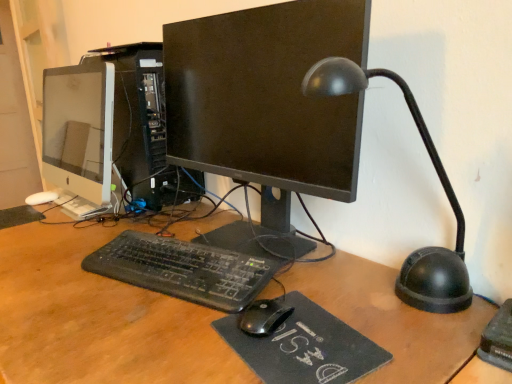
Question: Considering their positions, is white glossy monitor at left, the first computer monitor in the left-to-right sequence, located in front of or behind black plastic table lamp at right?

Choices:
 (A) front
 (B) behind

Answer: (B)

Question: From the image's perspective, is white glossy monitor at left, the first computer monitor in the left-to-right sequence, located above or below black plastic table lamp at right?

Choices:
 (A) above
 (B) below

Answer: (A)

Question: Which object is the closest to the black felt mousepad at center?

Choices:
 (A) white glossy monitor at left, the first computer monitor in the left-to-right sequence
 (B) black plastic keyboard at center
 (C) black matte monitor at center, which appears as the 2th computer monitor when viewed from the left
 (D) black plastic table lamp at right
 (E) satin black computer tower at center

Answer: (B)

Question: Estimate the real-world distances between objects in this image. Which object is closer to the black plastic keyboard at center?

Choices:
 (A) black matte monitor at center, which is counted as the 1th computer monitor, starting from the right
 (B) black felt mousepad at center
 (C) white glossy monitor at left, the first computer monitor in the left-to-right sequence
 (D) black plastic table lamp at right
 (E) satin black computer tower at center

Answer: (B)